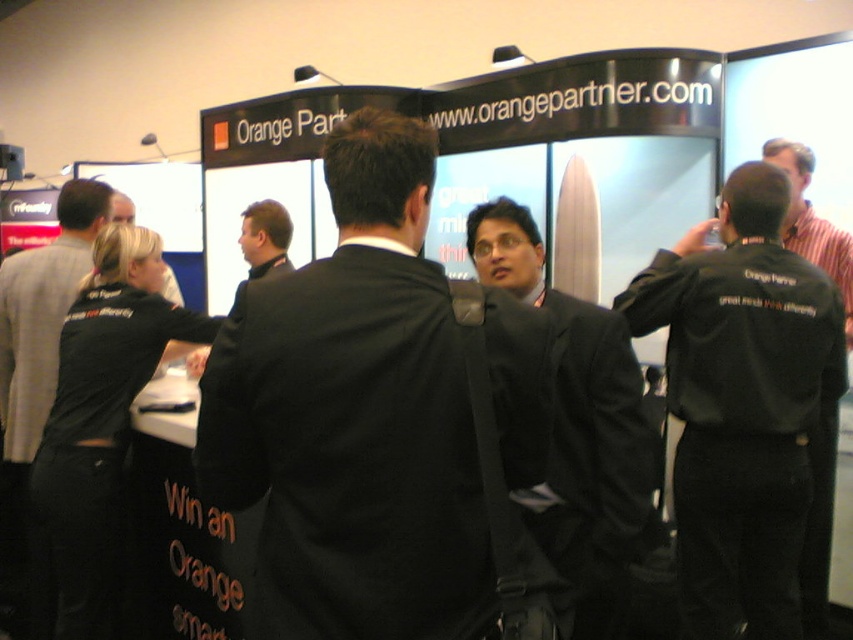
Question: Is black fabric suit at center smaller than black fabric business suit at left?

Choices:
 (A) no
 (B) yes

Answer: (B)

Question: Which point is closer to the camera?

Choices:
 (A) matte black suit at center
 (B) black fabric business suit at left
 (C) black fabric jacket at upper right
 (D) black fabric suit at center

Answer: (D)

Question: Can you confirm if black fabric jacket at upper right is smaller than black fabric shirt at left?

Choices:
 (A) no
 (B) yes

Answer: (A)

Question: Can you confirm if black fabric suit at center is positioned below black fabric business suit at left?

Choices:
 (A) no
 (B) yes

Answer: (A)

Question: Which of these objects is positioned farthest from the matte black suit at center?

Choices:
 (A) black fabric suit at center
 (B) black fabric jacket at upper right
 (C) black fabric business suit at left

Answer: (C)

Question: Which point appears closest to the camera in this image?

Choices:
 (A) (786, 397)
 (B) (564, 468)
 (C) (483, 588)

Answer: (C)